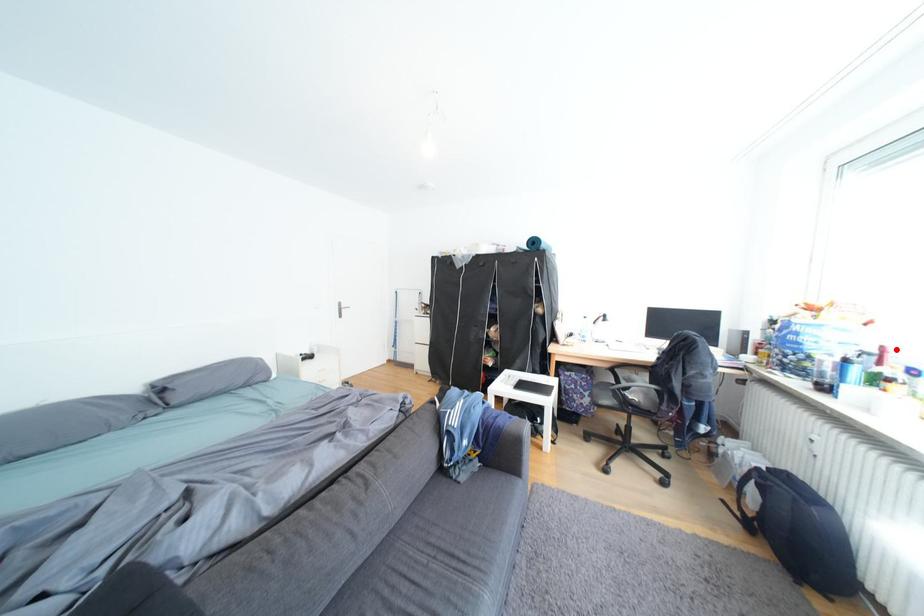
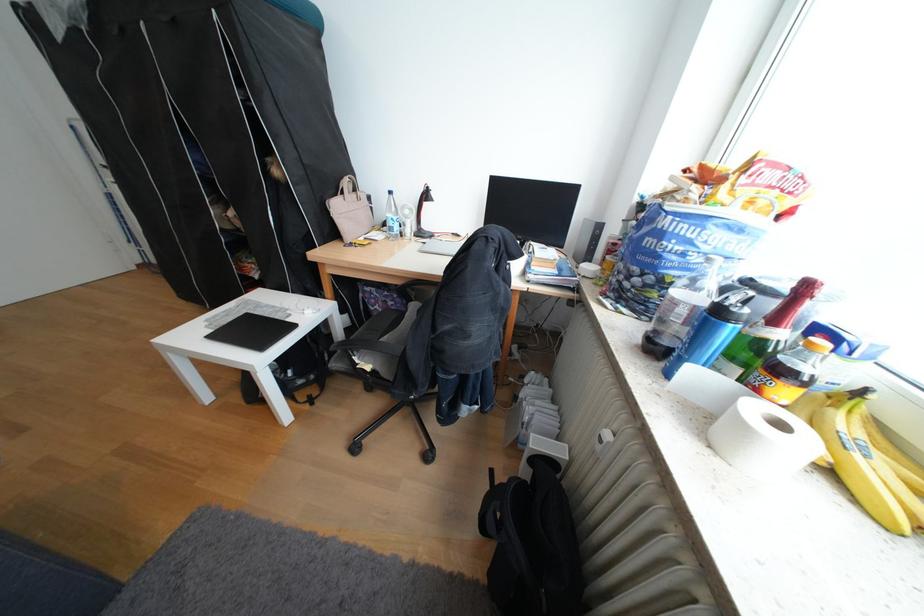
In the second image, find the point that corresponds to the highlighted location in the first image.

(819, 288)